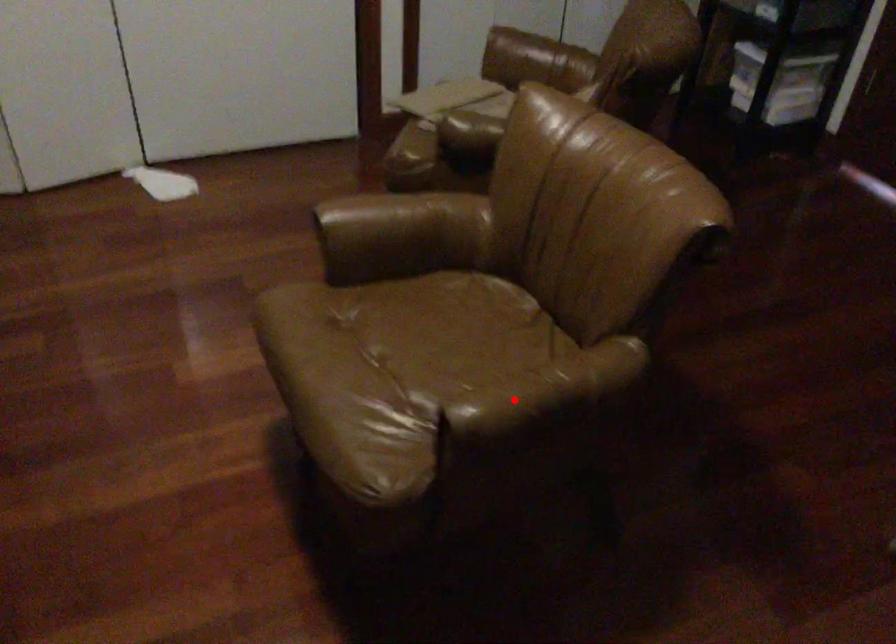
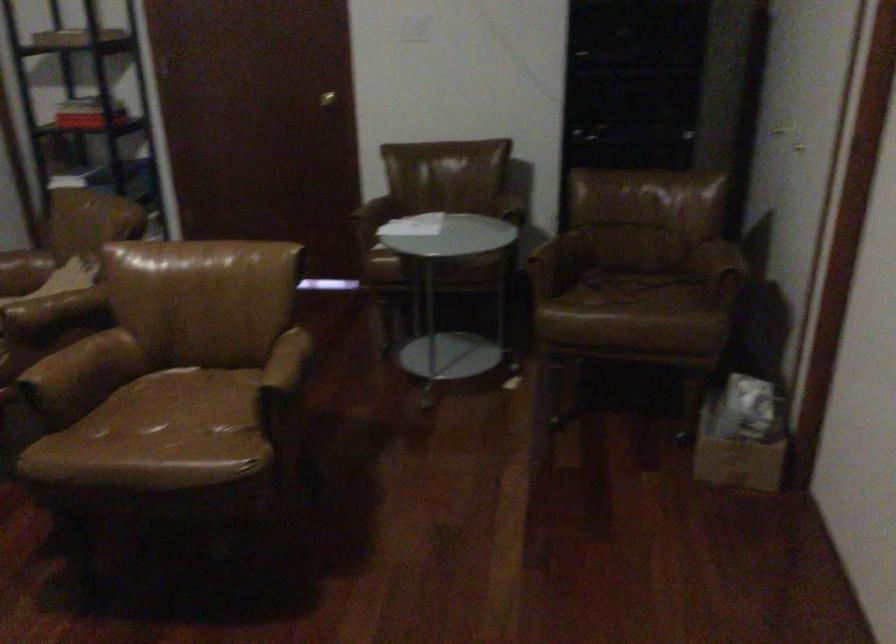
In the second image, find the point that corresponds to the highlighted location in the first image.

(283, 371)